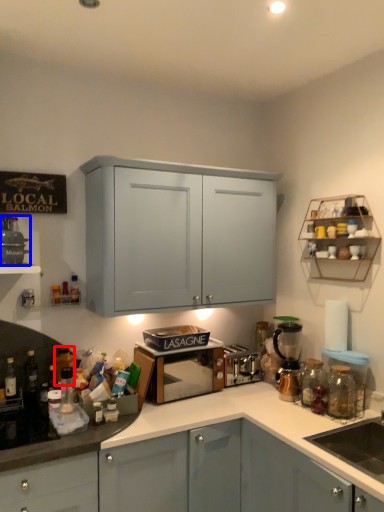
Question: Among these objects, which one is nearest to the camera, bottle (highlighted by a red box) or appliance (highlighted by a blue box)?

Choices:
 (A) bottle
 (B) appliance

Answer: (B)